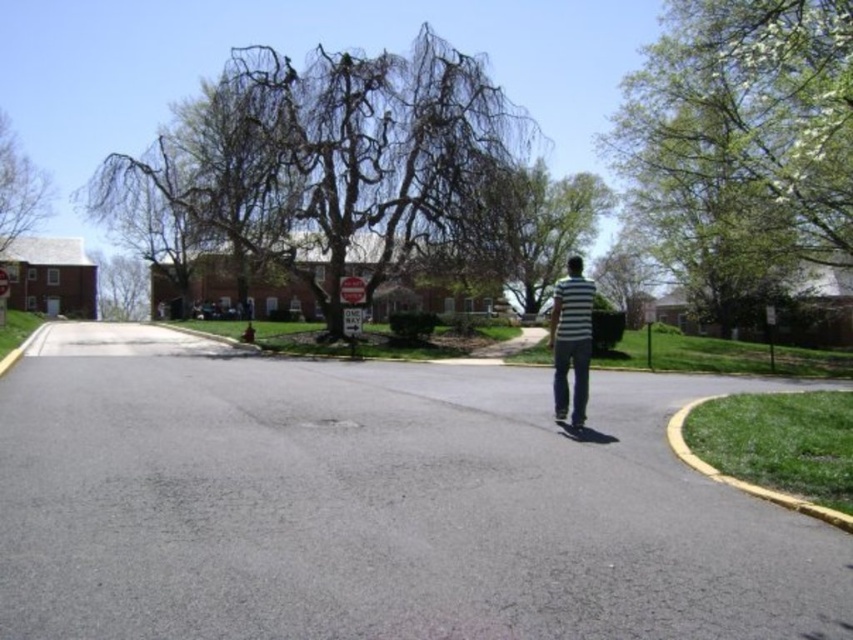
Which is more to the right, dark brown textured tree at upper center or green leafy tree at left?

dark brown textured tree at upper center is more to the right.

Can you confirm if dark brown textured tree at upper center is wider than green leafy tree at left?

Yes, dark brown textured tree at upper center is wider than green leafy tree at left.

The width and height of the screenshot is (853, 640). Describe the element at coordinates (331, 163) in the screenshot. I see `dark brown textured tree at upper center` at that location.

The image size is (853, 640). Find the location of `dark brown textured tree at upper center`. dark brown textured tree at upper center is located at coordinates (331, 163).

Does point (819, 163) lie in front of point (560, 413)?

No, it is behind (560, 413).

Can you confirm if green leafy tree at upper right is positioned to the right of black rubber skateboard at center?

Yes, green leafy tree at upper right is to the right of black rubber skateboard at center.

Does point (711, 81) come in front of point (556, 426)?

No, it is not.

The height and width of the screenshot is (640, 853). I want to click on green leafy tree at upper right, so click(743, 134).

Between green leafy tree at left and red metallic stop sign at center, which one is positioned lower?

red metallic stop sign at center is below.

Find the location of a particular element. The height and width of the screenshot is (640, 853). green leafy tree at left is located at coordinates point(19,188).

Identify the location of green leafy tree at left. (19, 188).